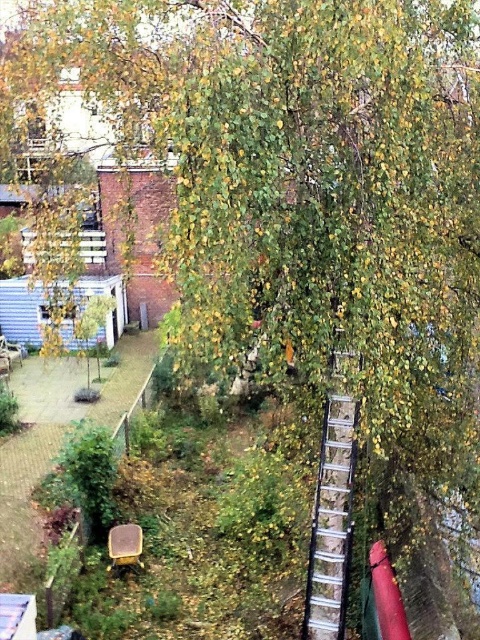
Question: Among these objects, which one is farthest from the camera?

Choices:
 (A) matte yellow chair at lower center
 (B) silver metallic ladder at upper center

Answer: (A)

Question: Which object appears farthest from the camera in this image?

Choices:
 (A) matte yellow chair at lower center
 (B) silver metallic ladder at upper center

Answer: (A)

Question: Can you confirm if silver metallic ladder at upper center is thinner than matte yellow chair at lower center?

Choices:
 (A) yes
 (B) no

Answer: (A)

Question: Is silver metallic ladder at upper center smaller than matte yellow chair at lower center?

Choices:
 (A) yes
 (B) no

Answer: (B)

Question: Where is silver metallic ladder at upper center located in relation to matte yellow chair at lower center in the image?

Choices:
 (A) right
 (B) left

Answer: (A)

Question: Which object is closer to the camera taking this photo?

Choices:
 (A) silver metallic ladder at upper center
 (B) matte yellow chair at lower center

Answer: (A)